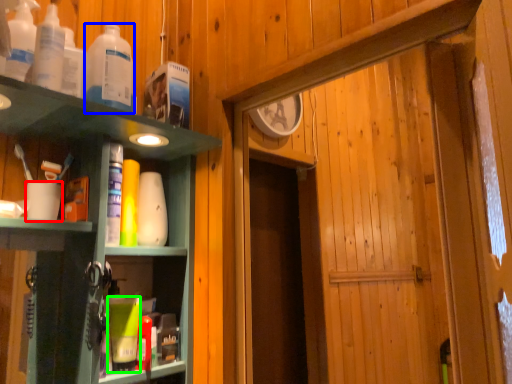
Question: Which object is positioned closest to coffee cup (highlighted by a red box)? Select from bottle (highlighted by a blue box) and toiletry (highlighted by a green box).

Choices:
 (A) bottle
 (B) toiletry

Answer: (A)